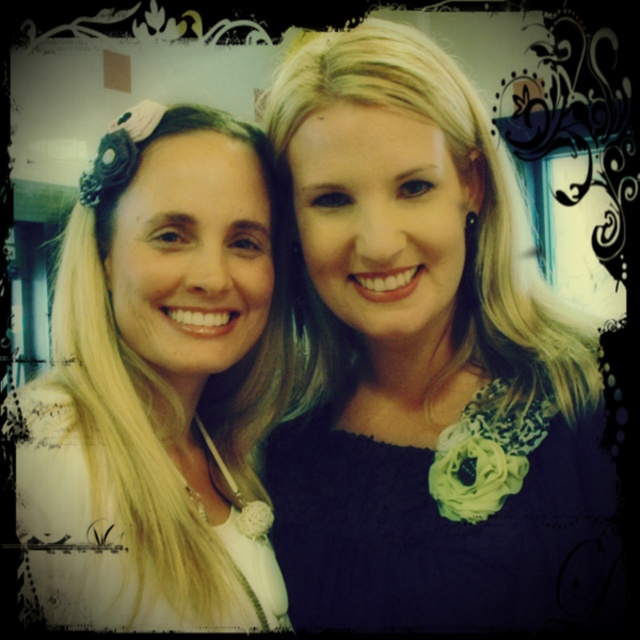
Which is below, matte black dress at center or white lace top at left?

white lace top at left is lower down.

Identify the location of matte black dress at center. The image size is (640, 640). (429, 365).

Where is `matte black dress at center`? The image size is (640, 640). matte black dress at center is located at coordinates (429, 365).

The width and height of the screenshot is (640, 640). I want to click on matte black dress at center, so click(429, 365).